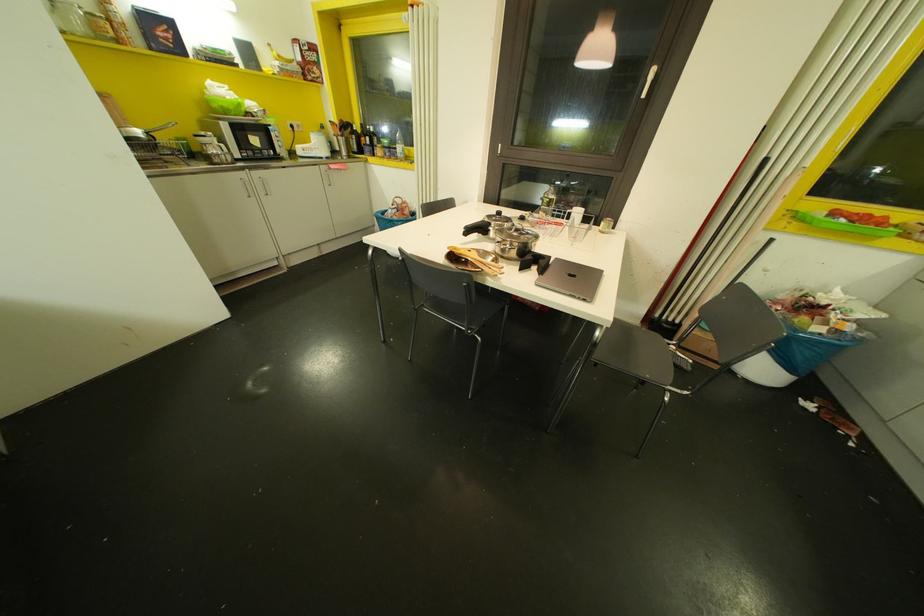
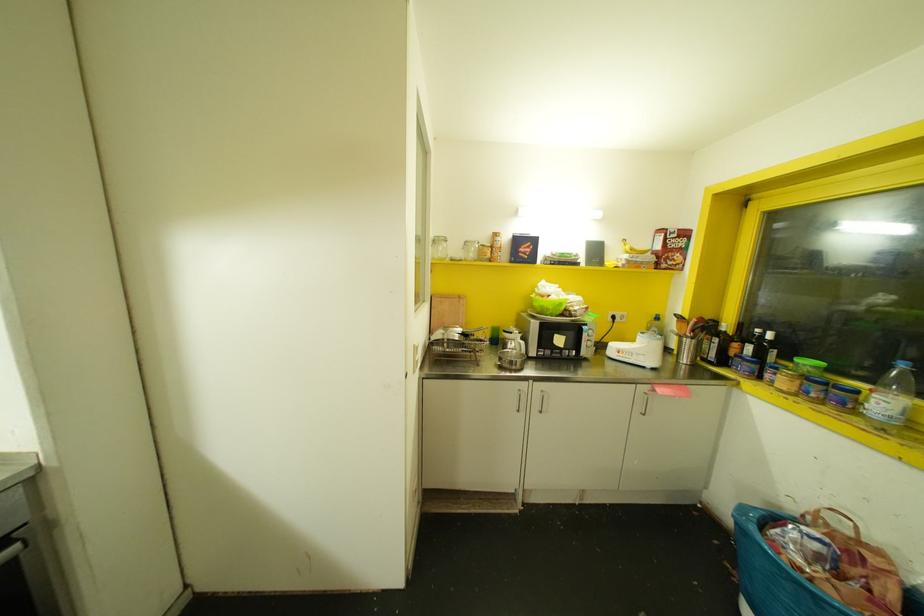
Locate, in the second image, the point that corresponds to (x=361, y=139) in the first image.

(735, 345)